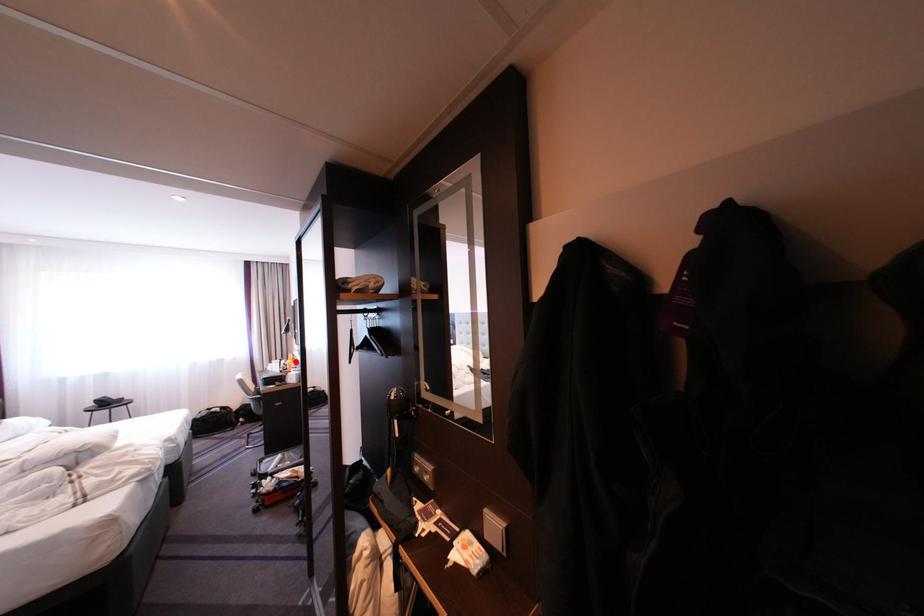
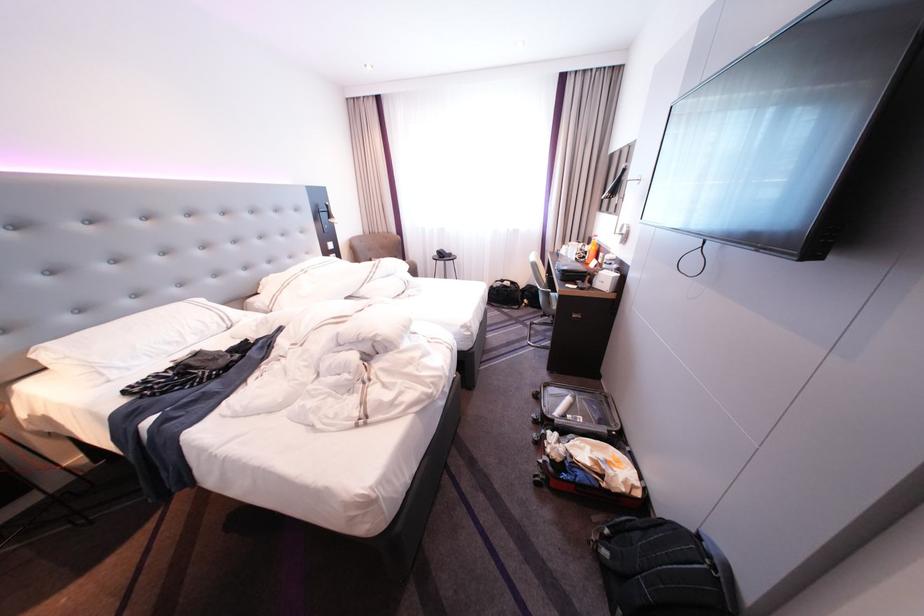
Question: I am providing you with two images of the same scene from different viewpoints. In image1, a red point is highlighted. Considering the same 3D point in image2, which of the following is correct?

Choices:
 (A) It is closer
 (B) It is farther

Answer: (A)